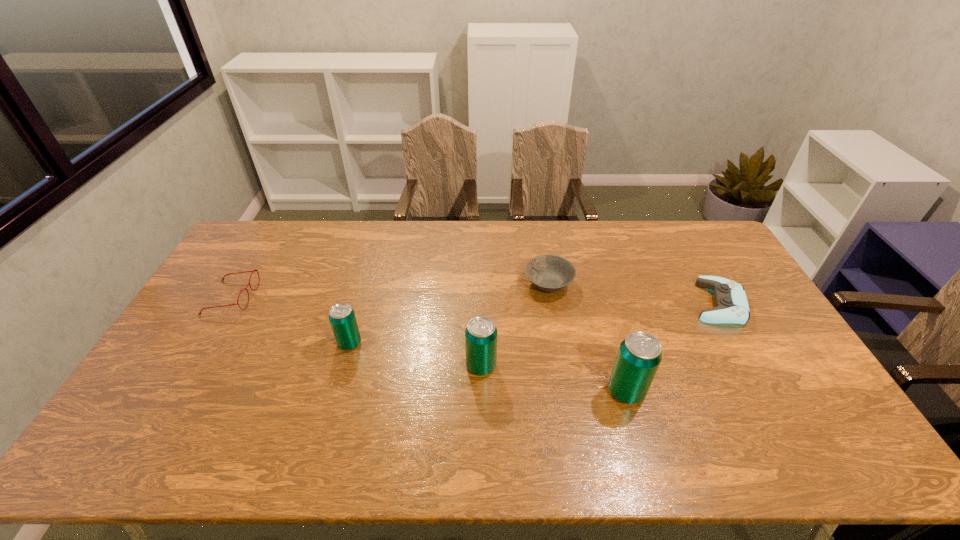
Identify the location of free space between the bowl and the leftmost object. (390, 291).

Point out which object is positioned as the nearest to the control. Please provide its 2D coordinates. Your answer should be formatted as a tuple, i.e. [(x, y)], where the tuple contains the x and y coordinates of a point satisfying the conditions above.

[(639, 355)]

Where is `object that is the second closest to the control`? This screenshot has height=540, width=960. object that is the second closest to the control is located at coordinates (549, 273).

Point out which beer can is positioned as the third nearest to the control. Please provide its 2D coordinates. Your answer should be formatted as a tuple, i.e. [(x, y)], where the tuple contains the x and y coordinates of a point satisfying the conditions above.

[(342, 317)]

The image size is (960, 540). I want to click on beer can that can be found as the second closest to the shortest beer can, so click(x=639, y=355).

Where is `vacant area that satisfies the following two spatial constraints: 1. on the back side of the rightmost beer can; 2. on the face of the spectacles`? The image size is (960, 540). vacant area that satisfies the following two spatial constraints: 1. on the back side of the rightmost beer can; 2. on the face of the spectacles is located at coordinates (599, 297).

Find the location of a particular element. This screenshot has width=960, height=540. free spot that satisfies the following two spatial constraints: 1. on the face of the leftmost beer can; 2. on the right side of the spectacles is located at coordinates (204, 343).

Identify the location of free point that satisfies the following two spatial constraints: 1. on the back side of the fifth shortest object; 2. on the left side of the control. (481, 303).

Image resolution: width=960 pixels, height=540 pixels. In order to click on free space in the image that satisfies the following two spatial constraints: 1. on the face of the leftmost object; 2. on the back side of the control in this screenshot , I will do `click(228, 303)`.

Identify the location of free space in the image that satisfies the following two spatial constraints: 1. on the front side of the rightmost beer can; 2. on the right side of the fourth object from left to right. The height and width of the screenshot is (540, 960). (566, 391).